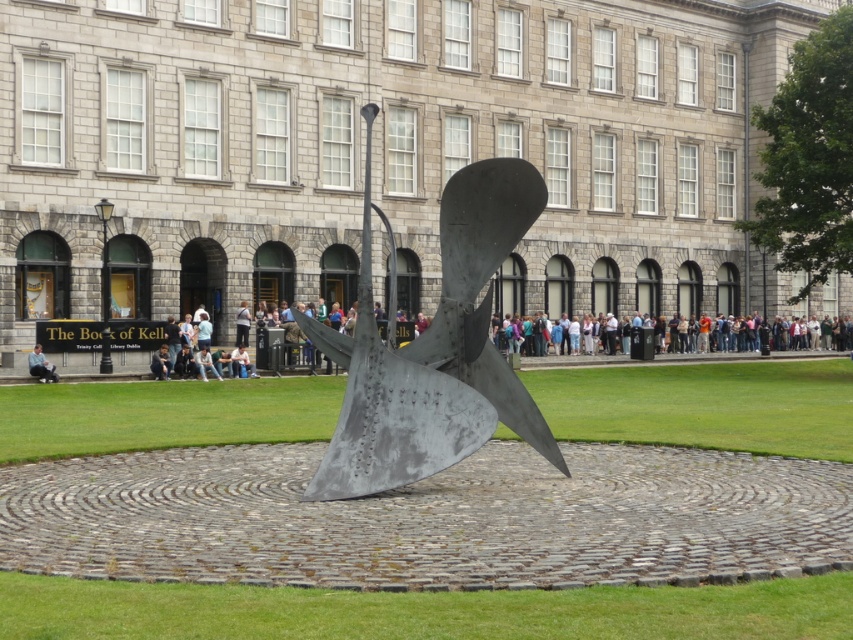
Question: Is green grass at center further to camera compared to metallic sculpture at center?

Choices:
 (A) yes
 (B) no

Answer: (B)

Question: Based on their relative distances, which object is farther from the metallic grass at center?

Choices:
 (A) green grass at center
 (B) light blue jeans at lower left
 (C) metallic sculpture at center
 (D) light blue denim jeans at lower center

Answer: (A)

Question: Observing the image, what is the correct spatial positioning of metallic grass at center in reference to light blue denim jeans at lower center?

Choices:
 (A) left
 (B) right

Answer: (B)

Question: Which object is the farthest from the light blue jeans at lower left?

Choices:
 (A) light blue denim jeans at lower center
 (B) metallic sculpture at center
 (C) metallic grass at center

Answer: (B)

Question: Does green grass at center have a lesser width compared to light blue denim jeans at lower center?

Choices:
 (A) yes
 (B) no

Answer: (B)

Question: Which object appears closest to the camera in this image?

Choices:
 (A) light blue denim jeans at lower center
 (B) metallic sculpture at center
 (C) light blue jeans at lower left
 (D) green grass at center

Answer: (D)